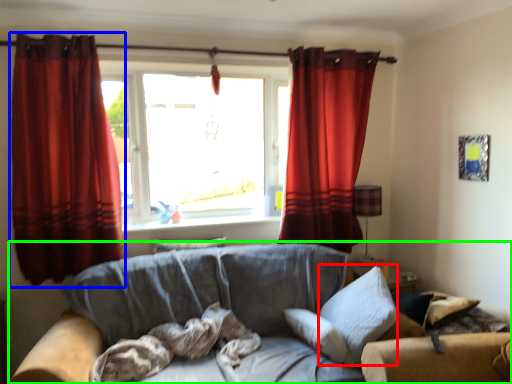
Question: Based on their relative distances, which object is farther from pillow (highlighted by a red box)? Choose from curtain (highlighted by a blue box) and studio couch (highlighted by a green box).

Choices:
 (A) curtain
 (B) studio couch

Answer: (A)